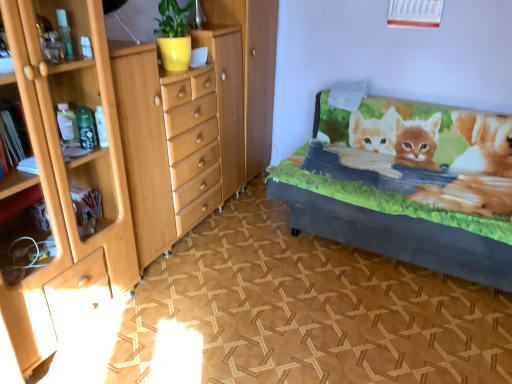
Question: Looking at the image, does velvet gray bed frame at right seem bigger or smaller compared to light wood chest of drawers at left?

Choices:
 (A) small
 (B) big

Answer: (B)

Question: Is velvet gray bed frame at right to the left or to the right of light wood chest of drawers at left in the image?

Choices:
 (A) left
 (B) right

Answer: (B)

Question: Is velvet gray bed frame at right inside or outside of light wood chest of drawers at left?

Choices:
 (A) outside
 (B) inside

Answer: (A)

Question: In terms of height, does light wood chest of drawers at left look taller or shorter compared to velvet gray bed frame at right?

Choices:
 (A) short
 (B) tall

Answer: (B)

Question: Considering the positions of light wood chest of drawers at left and velvet gray bed frame at right in the image, is light wood chest of drawers at left bigger or smaller than velvet gray bed frame at right?

Choices:
 (A) big
 (B) small

Answer: (B)

Question: Based on their positions, is light wood chest of drawers at left located to the left or right of velvet gray bed frame at right?

Choices:
 (A) left
 (B) right

Answer: (A)

Question: In the image, is light wood chest of drawers at left positioned in front of or behind velvet gray bed frame at right?

Choices:
 (A) front
 (B) behind

Answer: (A)